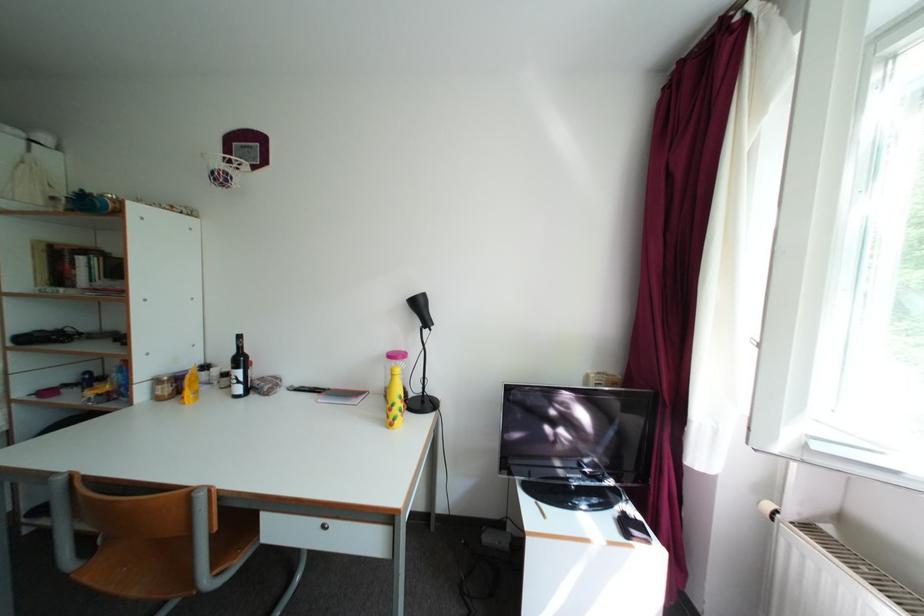
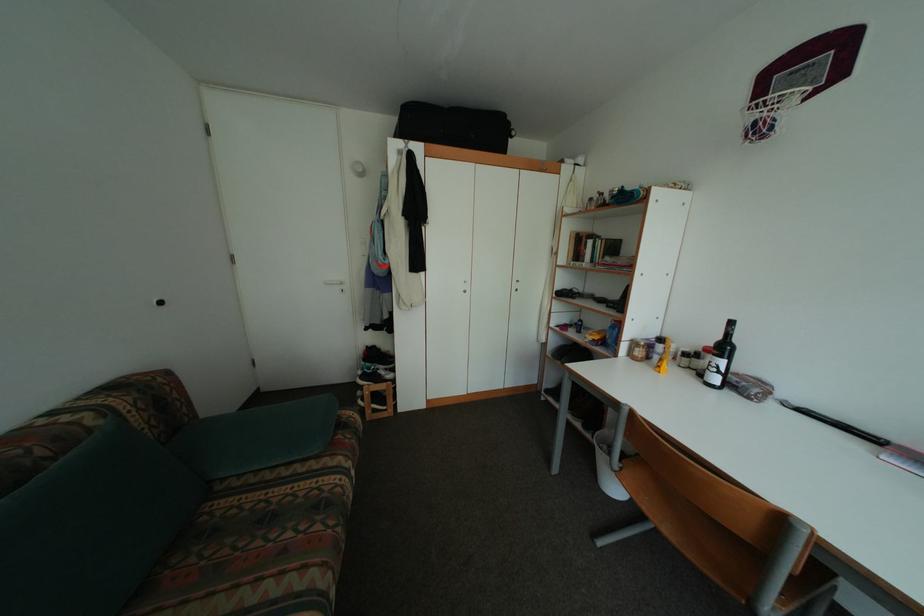
Question: The camera is either moving clockwise (left) or counter-clockwise (right) around the object. The first image is from the beginning of the video and the second image is from the end. Is the camera moving left or right when shooting the video?

Choices:
 (A) Left
 (B) Right

Answer: (B)